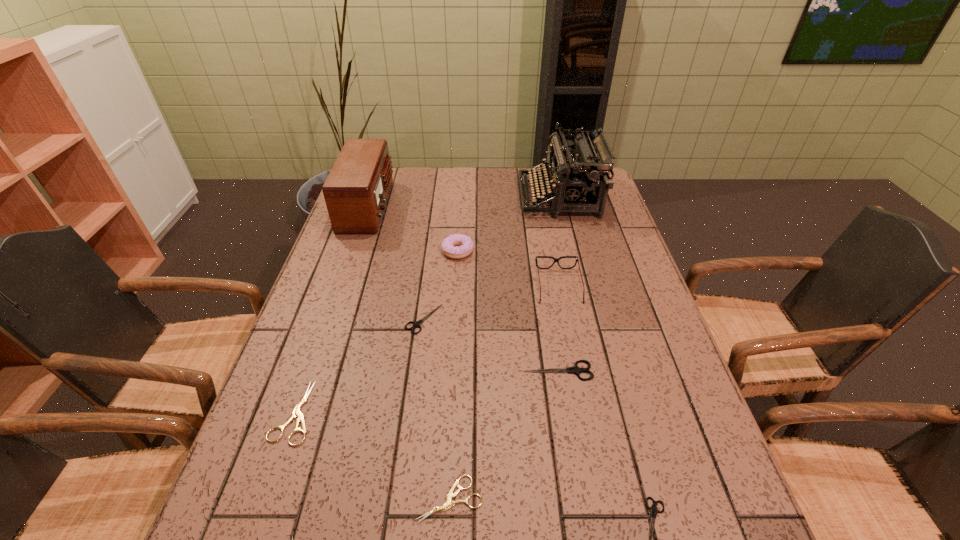
Locate an element on the screen. typewriter is located at coordinates (582, 177).

Where is `radio receiver`? The image size is (960, 540). radio receiver is located at coordinates (356, 190).

Image resolution: width=960 pixels, height=540 pixels. Identify the location of spectacles. (555, 259).

Image resolution: width=960 pixels, height=540 pixels. I want to click on the fourth tallest object, so click(x=465, y=244).

Where is `the eighth nearest object`? This screenshot has height=540, width=960. the eighth nearest object is located at coordinates (465, 244).

Locate an element on the screen. the tallest shears is located at coordinates point(575,369).

The image size is (960, 540). What are the coordinates of `the second black shears from left to right` in the screenshot? It's located at (575, 369).

The width and height of the screenshot is (960, 540). Identify the location of the farthest black shears. (417, 324).

At what (x,y) coordinates should I click in order to perform the action: click on the second biggest black shears. Please return your answer as a coordinate pair (x, y). Looking at the image, I should click on (417, 324).

At what (x,y) coordinates should I click in order to perform the action: click on the leftmost beige shears. Please return your answer as a coordinate pair (x, y). Looking at the image, I should click on (296, 412).